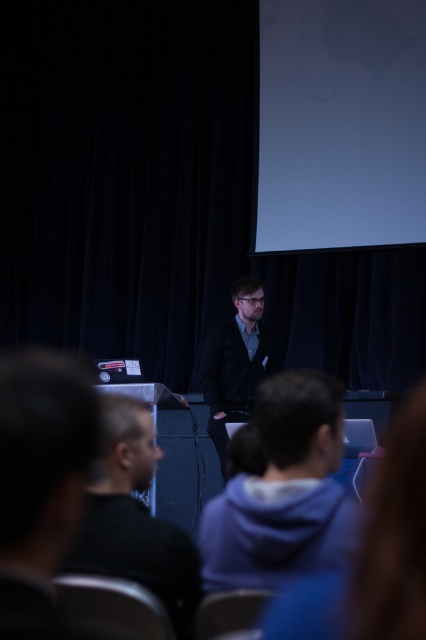
You are sitting at the back of the lecture hall and want to see the speaker clearly. There are two people in front of you wearing a dark gray hoodie at center and a dark blue jacket at center. Which one is blocking your view more?

The dark gray hoodie at center is blocking your view more because it is above the dark blue jacket at center, meaning it is closer to your line of sight.

You are sitting in the audience at the back of the room and want to see the speaker clearly. Which of the two dark gray hoodies, the dark gray hoodie at center or the dark gray hoodie at lower center, is blocking your view more?

The dark gray hoodie at lower center is behind dark gray hoodie at center, so the dark gray hoodie at center is blocking your view more since it is in front.